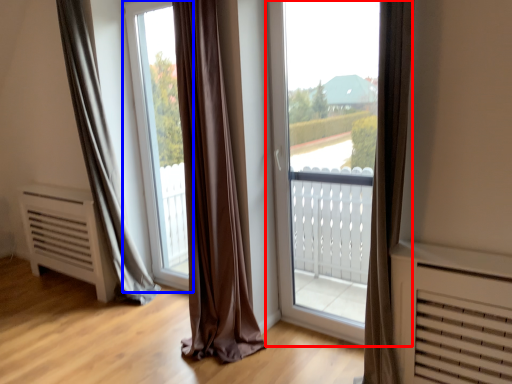
Question: Which object appears farthest to the camera in this image, window (highlighted by a red box) or window screen (highlighted by a blue box)?

Choices:
 (A) window
 (B) window screen

Answer: (B)